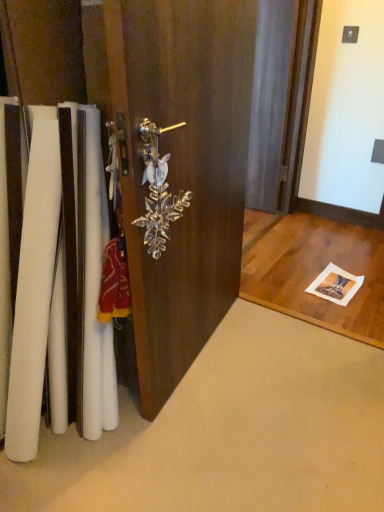
This screenshot has height=512, width=384. I want to click on clear crystal snowflake at center, so click(x=158, y=190).

This screenshot has height=512, width=384. Describe the element at coordinates (158, 190) in the screenshot. I see `clear crystal snowflake at center` at that location.

Where is `clear glass snowflake at center`? This screenshot has width=384, height=512. clear glass snowflake at center is located at coordinates (182, 169).

This screenshot has height=512, width=384. Describe the element at coordinates (182, 169) in the screenshot. I see `clear glass snowflake at center` at that location.

Where is `clear crystal snowflake at center`? clear crystal snowflake at center is located at coordinates (158, 190).

Considering the relative positions of clear glass snowflake at center and clear crystal snowflake at center in the image provided, is clear glass snowflake at center to the left of clear crystal snowflake at center from the viewer's perspective?

No, clear glass snowflake at center is not to the left of clear crystal snowflake at center.

Which object is further away from the camera, clear glass snowflake at center or clear crystal snowflake at center?

clear crystal snowflake at center is further away from the camera.

Does point (245, 108) come in front of point (142, 225)?

No.

From the image's perspective, between clear glass snowflake at center and clear crystal snowflake at center, who is located below?

clear crystal snowflake at center.

From a real-world perspective, who is located lower, clear glass snowflake at center or clear crystal snowflake at center?

From a 3D spatial view, clear glass snowflake at center is below.

Which of these two, clear glass snowflake at center or clear crystal snowflake at center, is wider?

clear glass snowflake at center.

Is clear glass snowflake at center taller than clear crystal snowflake at center?

Yes, clear glass snowflake at center is taller than clear crystal snowflake at center.

Can you confirm if clear glass snowflake at center is smaller than clear crystal snowflake at center?

No, clear glass snowflake at center is not smaller than clear crystal snowflake at center.

Would you say clear glass snowflake at center is inside or outside clear crystal snowflake at center?

clear glass snowflake at center is outside clear crystal snowflake at center.

Is clear glass snowflake at center next to clear crystal snowflake at center?

No.

Is clear glass snowflake at center oriented away from clear crystal snowflake at center?

Yes.

How many degrees apart are the facing directions of clear glass snowflake at center and clear crystal snowflake at center?

0.268 degrees.

Find the location of a particular element. door in front of the clear crystal snowflake at center is located at coordinates (182, 169).

Looking at this image, is clear crystal snowflake at center at the right side of clear glass snowflake at center?

Incorrect, clear crystal snowflake at center is not on the right side of clear glass snowflake at center.

Is clear crystal snowflake at center further to camera compared to clear glass snowflake at center?

Yes, it is behind clear glass snowflake at center.

Is point (163, 238) closer or farther from the camera than point (120, 113)?

Point (163, 238).

From the image's perspective, which object appears higher, clear crystal snowflake at center or clear glass snowflake at center?

clear glass snowflake at center, from the image's perspective.

From a real-world perspective, is clear crystal snowflake at center positioned above or below clear glass snowflake at center?

From a real-world perspective, clear crystal snowflake at center is physically above clear glass snowflake at center.

Considering the sizes of objects clear crystal snowflake at center and clear glass snowflake at center in the image provided, who is thinner, clear crystal snowflake at center or clear glass snowflake at center?

Thinner between the two is clear crystal snowflake at center.

Can you confirm if clear crystal snowflake at center is taller than clear glass snowflake at center?

No.

Considering the sizes of clear crystal snowflake at center and clear glass snowflake at center in the image, is clear crystal snowflake at center bigger or smaller than clear glass snowflake at center?

clear crystal snowflake at center is smaller than clear glass snowflake at center.

Which is correct: clear crystal snowflake at center is inside clear glass snowflake at center, or outside of it?

clear crystal snowflake at center is contained in clear glass snowflake at center.

Does clear crystal snowflake at center touch clear glass snowflake at center?

clear crystal snowflake at center and clear glass snowflake at center are not in contact.

Could you tell me if clear crystal snowflake at center is turned towards clear glass snowflake at center?

Yes, clear crystal snowflake at center is facing clear glass snowflake at center.

What's the angular difference between clear crystal snowflake at center and clear glass snowflake at center's facing directions?

They differ by 0.268 degrees in their facing directions.

This screenshot has width=384, height=512. Identify the location of door handle on the left of the clear glass snowflake at center. (158, 190).

Identify the location of door to the right of clear crystal snowflake at center. (182, 169).

The width and height of the screenshot is (384, 512). Find the location of `door that is in front of the clear crystal snowflake at center`. door that is in front of the clear crystal snowflake at center is located at coordinates (182, 169).